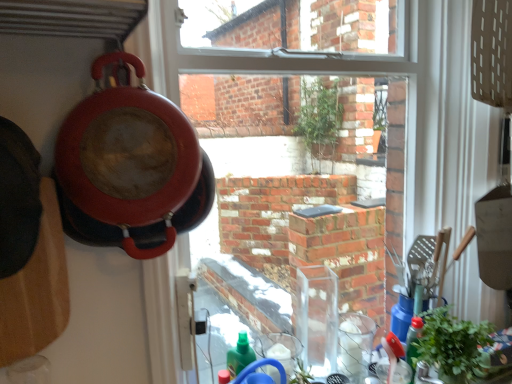
What do you see at coordinates (452, 346) in the screenshot? The height and width of the screenshot is (384, 512). I see `green leafy plant at lower right` at bounding box center [452, 346].

Find the location of a particular element. The image size is (512, 384). green leafy plant at lower right is located at coordinates (452, 346).

In order to face green leafy plant at lower right, should I rotate leftwards or rightwards?

Turn right approximately 24.983 degrees to face it.

I want to click on matte red pizza pan at left, so pyautogui.click(x=127, y=153).

Measure the distance between point (169,121) and camera.

Point (169,121) is 30.20 inches from camera.

What do you see at coordinates (127, 153) in the screenshot? This screenshot has width=512, height=384. I see `matte red pizza pan at left` at bounding box center [127, 153].

What are the coordinates of `green leafy plant at lower right` in the screenshot? It's located at (452, 346).

Is green leafy plant at lower right to the left of matte red pizza pan at left from the viewer's perspective?

No, green leafy plant at lower right is not to the left of matte red pizza pan at left.

Which object is closer to the camera taking this photo, green leafy plant at lower right or matte red pizza pan at left?

matte red pizza pan at left is in front.

Does point (444, 376) appear closer or farther from the camera than point (121, 103)?

Point (444, 376).

From the image's perspective, which one is positioned lower, green leafy plant at lower right or matte red pizza pan at left?

green leafy plant at lower right.

From the picture: From a real-world perspective, who is located higher, green leafy plant at lower right or matte red pizza pan at left?

matte red pizza pan at left, from a real-world perspective.

Which of these two, green leafy plant at lower right or matte red pizza pan at left, is wider?

Wider between the two is green leafy plant at lower right.

Looking at this image, can you confirm if green leafy plant at lower right is taller than matte red pizza pan at left?

In fact, green leafy plant at lower right may be shorter than matte red pizza pan at left.

Considering the relative sizes of green leafy plant at lower right and matte red pizza pan at left in the image provided, is green leafy plant at lower right smaller than matte red pizza pan at left?

Correct, green leafy plant at lower right occupies less space than matte red pizza pan at left.

Is green leafy plant at lower right situated inside matte red pizza pan at left or outside?

green leafy plant at lower right is spatially situated outside matte red pizza pan at left.

Is green leafy plant at lower right with matte red pizza pan at left?

No, green leafy plant at lower right is not making contact with matte red pizza pan at left.

Looking at this image, does green leafy plant at lower right turn towards matte red pizza pan at left?

No, green leafy plant at lower right is not facing towards matte red pizza pan at left.

Locate an element on the screen. The height and width of the screenshot is (384, 512). houseplant located on the right of matte red pizza pan at left is located at coordinates point(452,346).

Considering the positions of objects matte red pizza pan at left and green leafy plant at lower right in the image provided, who is more to the right, matte red pizza pan at left or green leafy plant at lower right?

green leafy plant at lower right.

Considering the positions of objects matte red pizza pan at left and green leafy plant at lower right in the image provided, who is in front, matte red pizza pan at left or green leafy plant at lower right?

matte red pizza pan at left is closer to the camera.

Which point is more forward, (84,121) or (457,375)?

The point (84,121) is closer to the camera.

From the image's perspective, is matte red pizza pan at left on green leafy plant at lower right?

Yes, from the image's perspective, matte red pizza pan at left is above green leafy plant at lower right.

From a real-world perspective, is matte red pizza pan at left on top of green leafy plant at lower right?

Correct, in the physical world, matte red pizza pan at left is higher than green leafy plant at lower right.

Based on the photo, does matte red pizza pan at left have a greater width compared to green leafy plant at lower right?

No, matte red pizza pan at left is not wider than green leafy plant at lower right.

From the picture: Between matte red pizza pan at left and green leafy plant at lower right, which one has more height?

matte red pizza pan at left is taller.

Based on their sizes in the image, would you say matte red pizza pan at left is bigger or smaller than green leafy plant at lower right?

matte red pizza pan at left is bigger than green leafy plant at lower right.

Which is correct: matte red pizza pan at left is inside green leafy plant at lower right, or outside of it?

matte red pizza pan at left lies outside green leafy plant at lower right.

From the picture: Does matte red pizza pan at left touch green leafy plant at lower right?

No, matte red pizza pan at left is not touching green leafy plant at lower right.

In the scene shown: Is green leafy plant at lower right at the back of matte red pizza pan at left?

No.

Find the location of a particular element. pizza pan on the left of green leafy plant at lower right is located at coordinates tap(127, 153).

Locate an element on the screen. The width and height of the screenshot is (512, 384). pizza pan on the left of green leafy plant at lower right is located at coordinates (127, 153).

Locate an element on the screen. houseplant on the right of the matte red pizza pan at left is located at coordinates (452, 346).